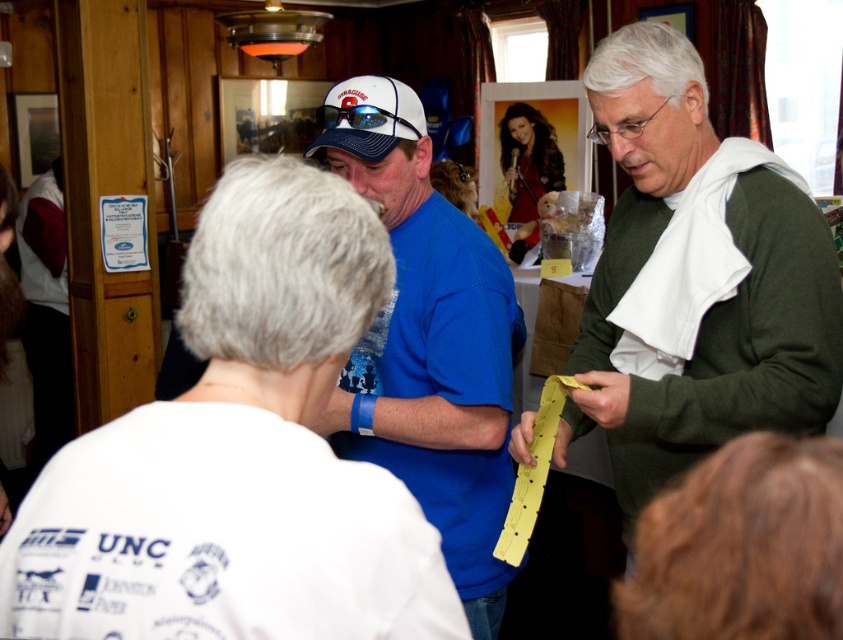
Question: Which point is closer to the camera?

Choices:
 (A) shiny brown hair at upper center
 (B) blue fabric shirt at center

Answer: (B)

Question: Which object is farther from the camera taking this photo?

Choices:
 (A) blue fabric shirt at center
 (B) green matte sweater at right
 (C) white fabric shirt at upper center
 (D) shiny brown hair at upper center

Answer: (D)

Question: Is blue fabric shirt at center positioned behind shiny brown hair at upper center?

Choices:
 (A) no
 (B) yes

Answer: (A)

Question: Does white fabric shirt at upper center appear over green matte sweater at right?

Choices:
 (A) yes
 (B) no

Answer: (B)

Question: Which point is closer to the camera taking this photo?

Choices:
 (A) (326, 410)
 (B) (514, 120)
 (C) (329, 506)
 (D) (621, 275)

Answer: (C)

Question: Is green matte sweater at right below shiny brown hair at upper center?

Choices:
 (A) yes
 (B) no

Answer: (A)